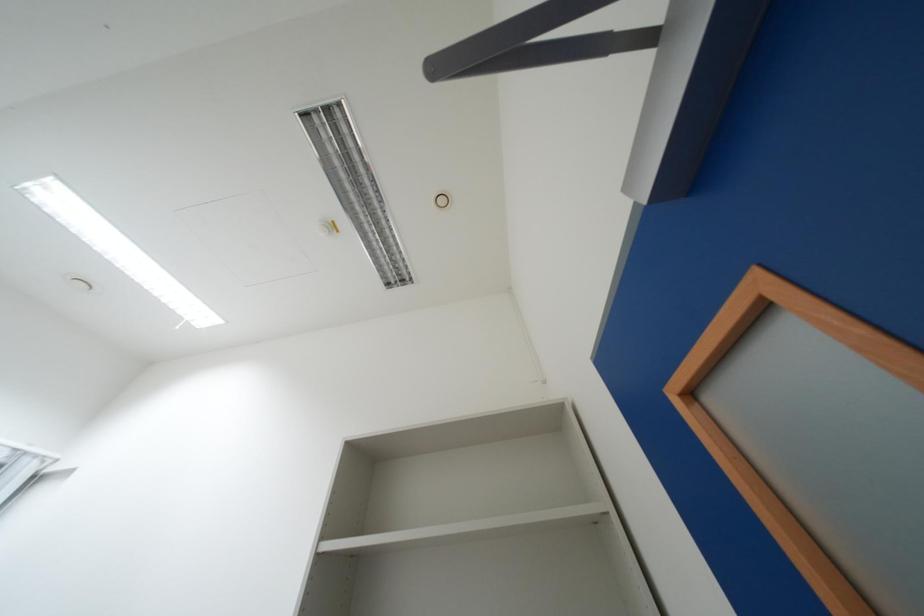
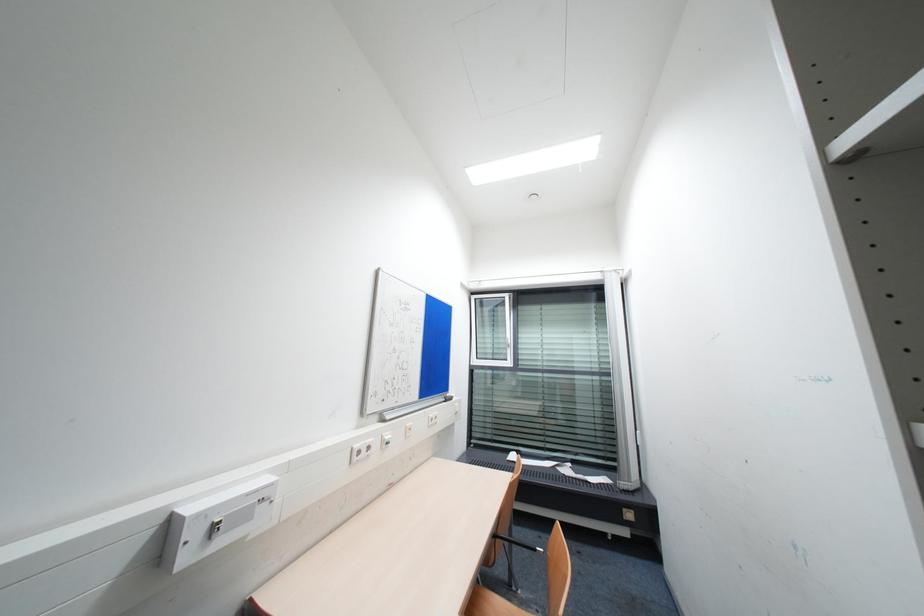
Question: The camera is either moving clockwise (left) or counter-clockwise (right) around the object. The first image is from the beginning of the video and the second image is from the end. Is the camera moving left or right when shooting the video?

Choices:
 (A) Left
 (B) Right

Answer: (B)